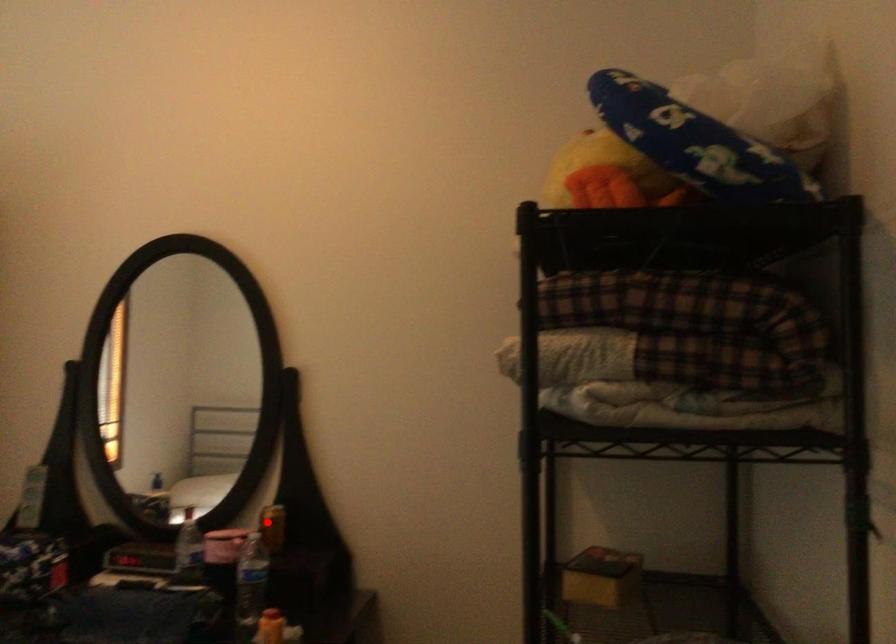
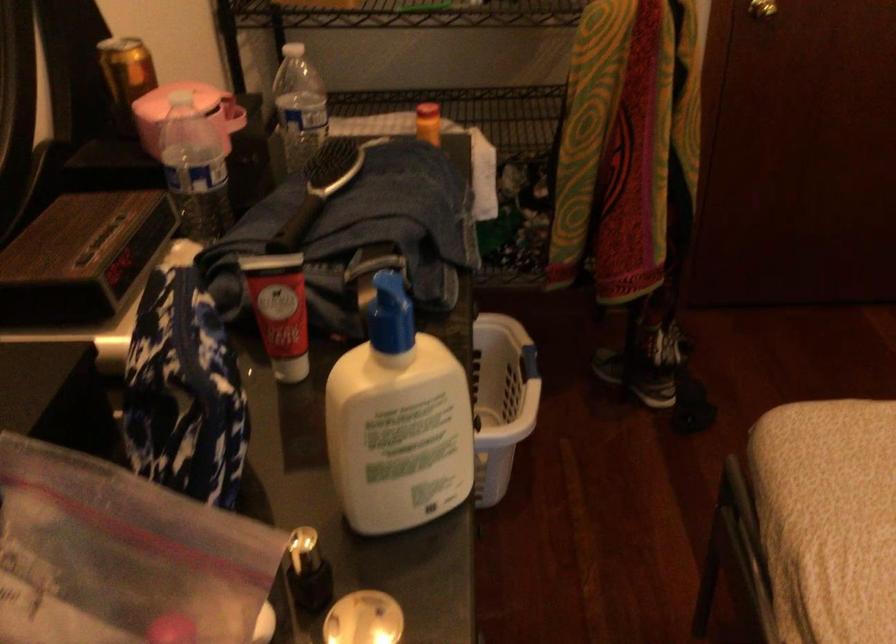
Where in the second image is the point corresponding to the highlighted location from the first image?

(125, 76)